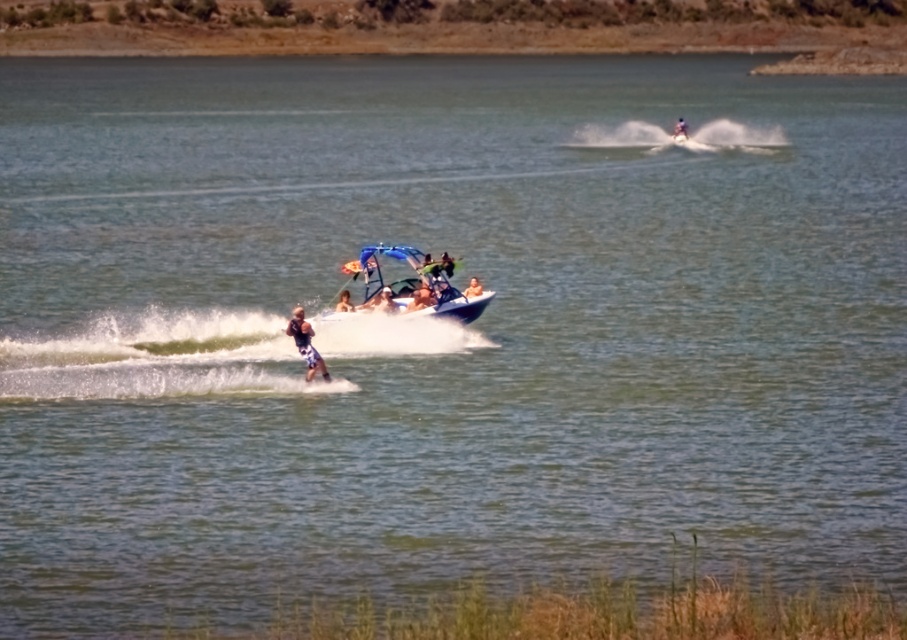
Can you confirm if smooth blue board at center is thinner than smooth tan skin at center?

No, smooth blue board at center is not thinner than smooth tan skin at center.

Locate an element on the screen. smooth blue board at center is located at coordinates (418, 300).

Who is positioned more to the right, smooth blue board at center or smooth white surfboard at upper center?

smooth white surfboard at upper center

Is point (408, 301) positioned after point (674, 131)?

No, it is in front of (674, 131).

What do you see at coordinates (418, 300) in the screenshot? The height and width of the screenshot is (640, 907). I see `smooth blue board at center` at bounding box center [418, 300].

At what (x,y) coordinates should I click in order to perform the action: click on smooth blue board at center. Please return your answer as a coordinate pair (x, y). Looking at the image, I should click on (418, 300).

Between smooth tan skin at center and smooth white surfboard at upper center, which one appears on the left side from the viewer's perspective?

smooth tan skin at center is more to the left.

Can you confirm if smooth tan skin at center is thinner than smooth white surfboard at upper center?

Yes.

Which is behind, point (476, 288) or point (681, 132)?

The point (681, 132) is more distant.

Locate an element on the screen. smooth tan skin at center is located at coordinates (472, 289).